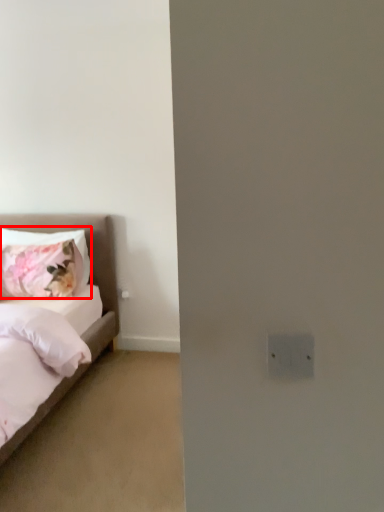
Question: Considering the relative positions of pillow (annotated by the red box) and bed in the image provided, where is pillow (annotated by the red box) located with respect to the staircase?

Choices:
 (A) left
 (B) right

Answer: (B)